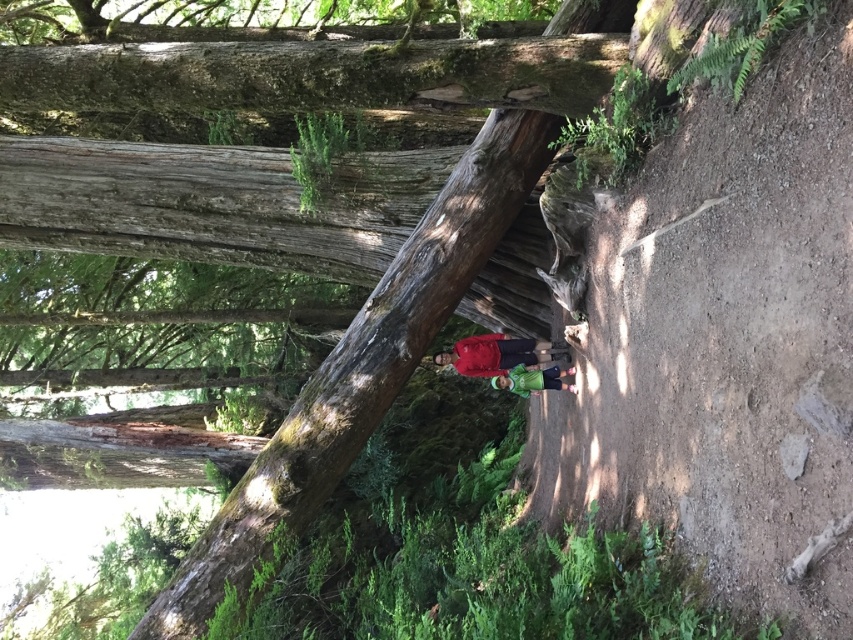
Is smooth brown log at center in front of red fabric jacket at center?

Yes, smooth brown log at center is in front of red fabric jacket at center.

Does point (317, 442) lie in front of point (466, 372)?

Yes, point (317, 442) is closer to viewer.

Identify the location of smooth brown log at center. This screenshot has width=853, height=640. (361, 369).

Can you confirm if red fabric jacket at center is positioned to the left of green matte shirt at center?

Indeed, red fabric jacket at center is positioned on the left side of green matte shirt at center.

Who is positioned more to the left, red fabric jacket at center or green matte shirt at center?

From the viewer's perspective, red fabric jacket at center appears more on the left side.

This screenshot has width=853, height=640. In order to click on red fabric jacket at center in this screenshot , I will do pyautogui.click(x=497, y=353).

Between smooth brown log at center and green matte shirt at center, which one is positioned lower?

green matte shirt at center

The width and height of the screenshot is (853, 640). I want to click on smooth brown log at center, so click(361, 369).